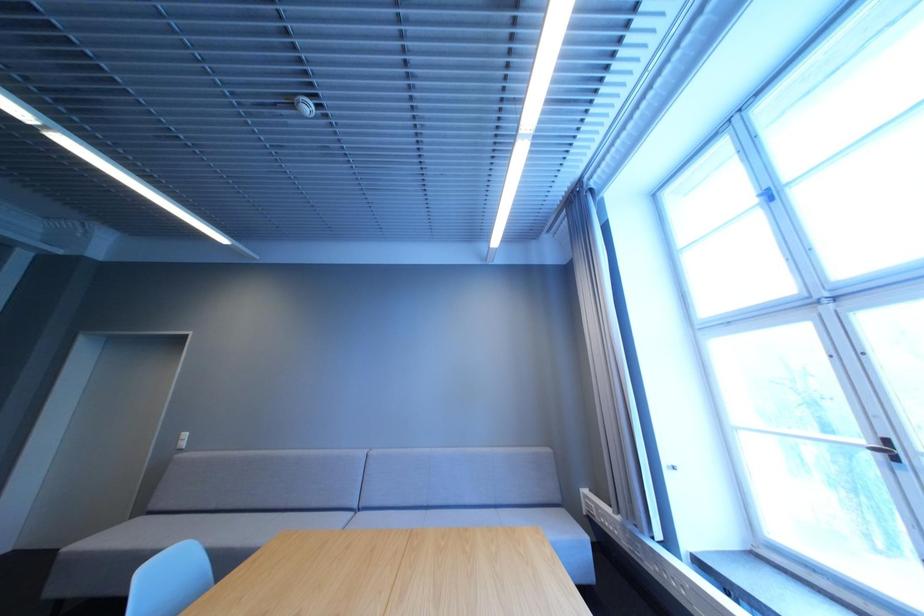
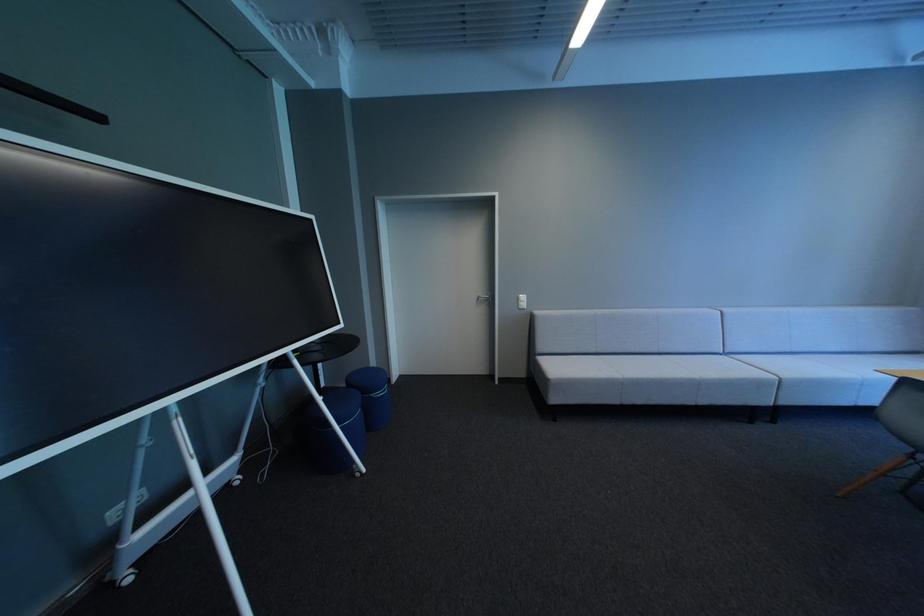
Question: What movement of the cameraman would produce the second image?

Choices:
 (A) Left
 (B) Right
 (C) Forward
 (D) Backward

Answer: (A)